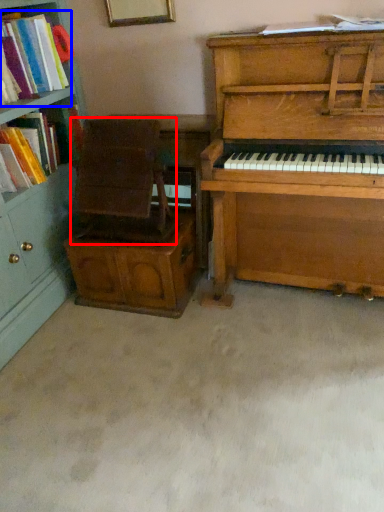
Question: Which object appears closest to the camera in this image, armchair (highlighted by a red box) or book (highlighted by a blue box)?

Choices:
 (A) armchair
 (B) book

Answer: (B)